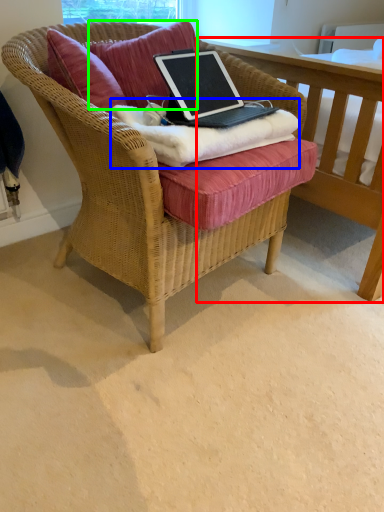
Question: Which object is the closest to the table (highlighted by a red box)? Choose among these: blanket (highlighted by a blue box) or pillow (highlighted by a green box).

Choices:
 (A) blanket
 (B) pillow

Answer: (A)